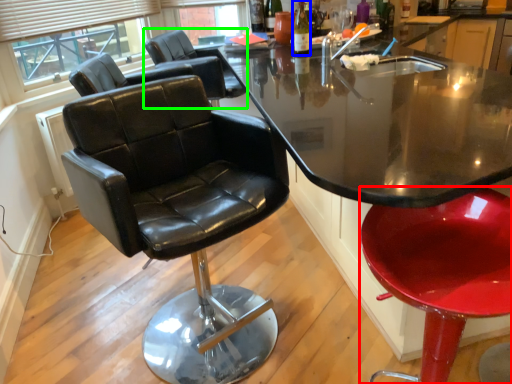
Question: Which object is positioned closest to chair (highlighted by a red box)? Select from bottle (highlighted by a blue box) and chair (highlighted by a green box).

Choices:
 (A) bottle
 (B) chair

Answer: (A)